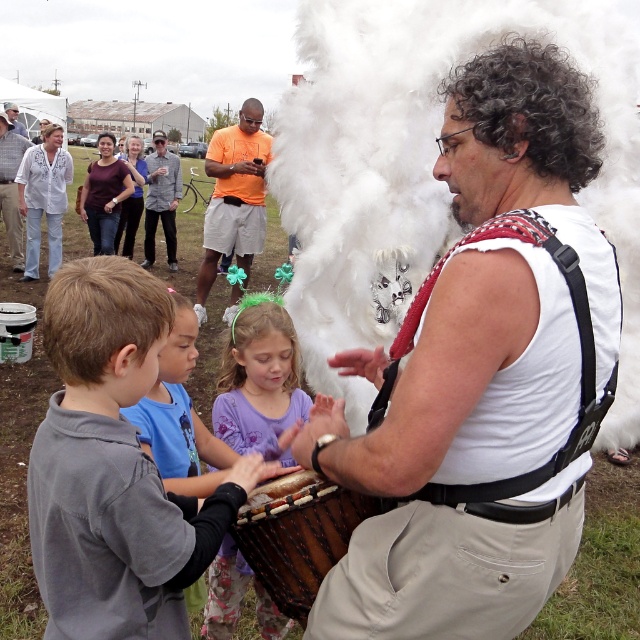
Question: Where is wooden drum at center located in relation to purple fabric headband at center in the image?

Choices:
 (A) above
 (B) below

Answer: (B)

Question: Among these points, which one is farthest from the camera?

Choices:
 (A) (236, 580)
 (B) (8, 218)

Answer: (B)

Question: Is white fluffy costume at center in front of gray matte shirt at center?

Choices:
 (A) no
 (B) yes

Answer: (B)

Question: Can you confirm if wooden drum at center is thinner than orange cotton shirt at center?

Choices:
 (A) yes
 (B) no

Answer: (A)

Question: Which point is closer to the camera taking this photo?

Choices:
 (A) (336, 362)
 (B) (12, 109)

Answer: (A)

Question: Which of these objects is positioned farthest from the white fluffy costume at center?

Choices:
 (A) brushed metal water at bottle left
 (B) purple fabric dress at center

Answer: (A)